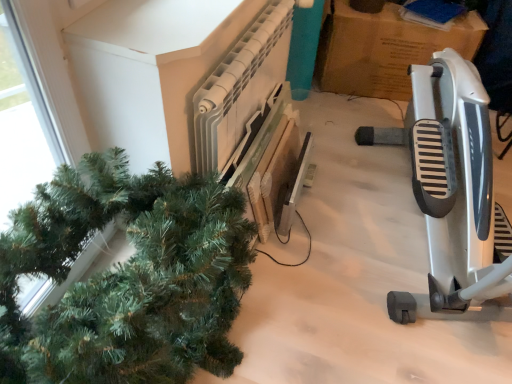
Question: Can you confirm if white plastic radiator at upper center is positioned to the left of green matte christmas tree at left?

Choices:
 (A) yes
 (B) no

Answer: (B)

Question: Is white plastic radiator at upper center shorter than green matte christmas tree at left?

Choices:
 (A) yes
 (B) no

Answer: (B)

Question: Considering the relative sizes of white plastic radiator at upper center and green matte christmas tree at left in the image provided, is white plastic radiator at upper center taller than green matte christmas tree at left?

Choices:
 (A) no
 (B) yes

Answer: (B)

Question: Is white plastic radiator at upper center further to the viewer compared to green matte christmas tree at left?

Choices:
 (A) yes
 (B) no

Answer: (A)

Question: Is white plastic radiator at upper center completely or partially outside of green matte christmas tree at left?

Choices:
 (A) yes
 (B) no

Answer: (A)

Question: Looking at their shapes, would you say green matte christmas tree at left is wider or thinner than silver metallic exercise bike at right?

Choices:
 (A) wide
 (B) thin

Answer: (B)

Question: Is green matte christmas tree at left inside or outside of silver metallic exercise bike at right?

Choices:
 (A) inside
 (B) outside

Answer: (B)

Question: From the image's perspective, is green matte christmas tree at left above or below silver metallic exercise bike at right?

Choices:
 (A) below
 (B) above

Answer: (A)

Question: Relative to silver metallic exercise bike at right, is green matte christmas tree at left in front or behind?

Choices:
 (A) behind
 (B) front

Answer: (A)

Question: Based on their positions, is white plastic radiator at upper center located to the left or right of green matte christmas tree at left?

Choices:
 (A) left
 (B) right

Answer: (B)

Question: Looking at the image, does white plastic radiator at upper center seem bigger or smaller compared to green matte christmas tree at left?

Choices:
 (A) big
 (B) small

Answer: (B)

Question: In terms of width, does white plastic radiator at upper center look wider or thinner when compared to green matte christmas tree at left?

Choices:
 (A) wide
 (B) thin

Answer: (B)

Question: From the image's perspective, is white plastic radiator at upper center located above or below green matte christmas tree at left?

Choices:
 (A) above
 (B) below

Answer: (A)

Question: Is silver metallic exercise bike at right taller or shorter than green matte christmas tree at left?

Choices:
 (A) short
 (B) tall

Answer: (B)

Question: From a real-world perspective, is silver metallic exercise bike at right positioned above or below green matte christmas tree at left?

Choices:
 (A) below
 (B) above

Answer: (B)